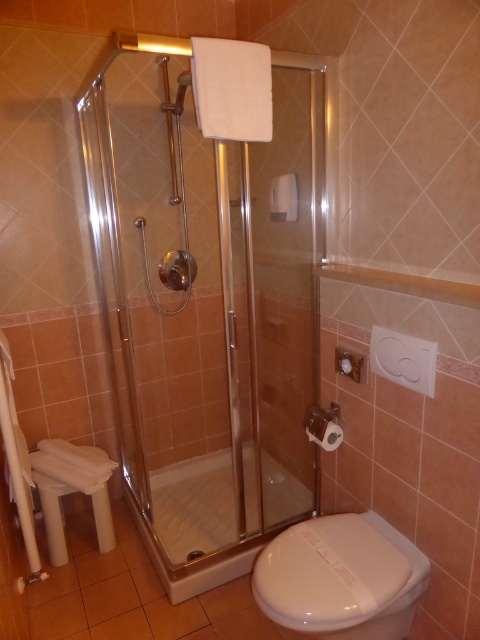
You are standing in the bathroom and want to locate the clear glass shower door at center. According to the scene description, where would you find it?

The clear glass shower door at center is located at the 2D coordinates point (205,305).

You are trying to move the white plastic stool at lower left closer to the clear glass shower door at center. Based on their sizes, which one is wider?

The clear glass shower door at center is wider than the white plastic stool at lower left according to the description.

You are standing in the bathroom and want to reach both points. Which point, point [320,234] or point [207,456], will you reach first?

Point [320,234] is closer to the viewer than point [207,456], so you will reach point [320,234] first.